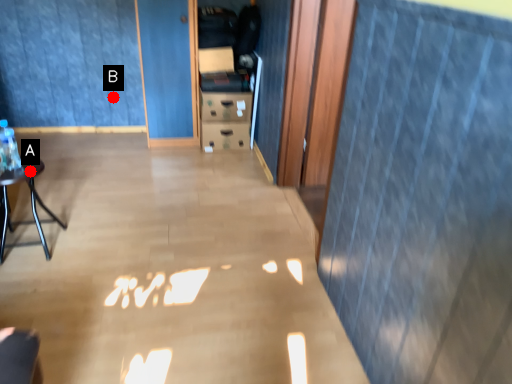
Question: Two points are circled on the image, labeled by A and B beside each circle. Which of the following is the farthest from the observer?

Choices:
 (A) A is further
 (B) B is further

Answer: (B)